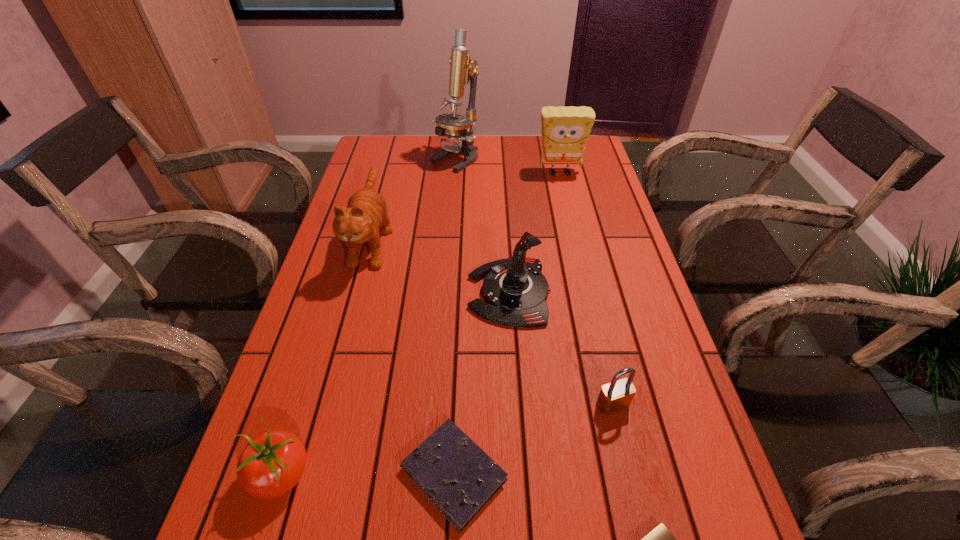
Where is `tomato located in the left edge section of the desktop`? tomato located in the left edge section of the desktop is located at coordinates (272, 463).

This screenshot has height=540, width=960. Find the location of `sponge at the right edge`. sponge at the right edge is located at coordinates (565, 131).

Where is `padlock that is at the right edge`? The width and height of the screenshot is (960, 540). padlock that is at the right edge is located at coordinates (617, 395).

Where is `object located at the far right corner`? The height and width of the screenshot is (540, 960). object located at the far right corner is located at coordinates tap(565, 131).

In order to click on blank space at the far edge of the desktop in this screenshot , I will do `click(456, 159)`.

In the image, there is a desktop. Where is `vacant area at the left edge`? The image size is (960, 540). vacant area at the left edge is located at coordinates 297,428.

Where is `free space at the right edge of the desktop`? free space at the right edge of the desktop is located at coordinates (615, 210).

Where is `vacant space at the far left corner of the desktop`? The height and width of the screenshot is (540, 960). vacant space at the far left corner of the desktop is located at coordinates (400, 156).

The height and width of the screenshot is (540, 960). Identify the location of vacant space at the far right corner of the desktop. (583, 163).

The image size is (960, 540). What are the coordinates of `free space between the sponge and the microscope` in the screenshot? It's located at click(x=508, y=166).